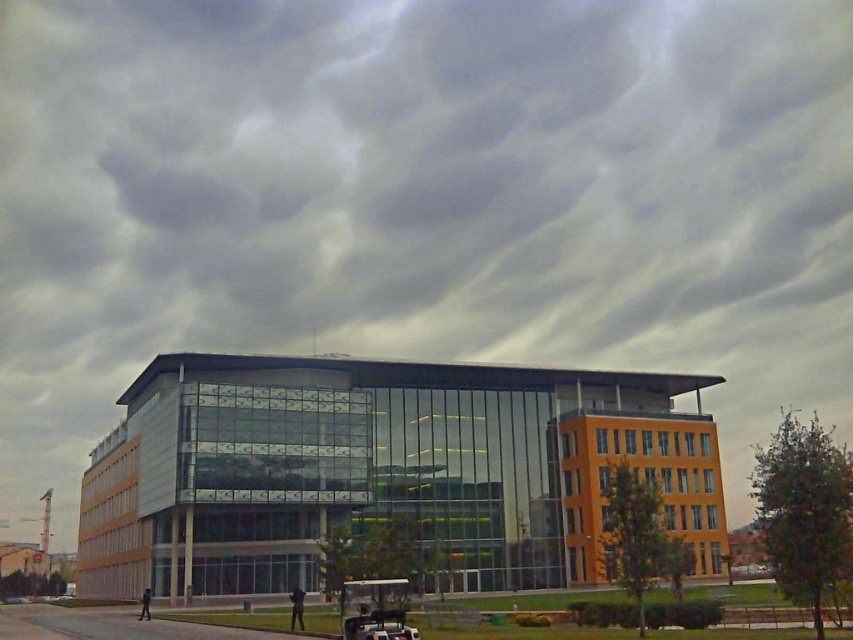
Between glassy modern building at center and white plastic golf cart at lower center, which one is positioned lower?

Positioned lower is glassy modern building at center.

What do you see at coordinates (381, 472) in the screenshot? I see `glassy modern building at center` at bounding box center [381, 472].

You are a GUI agent. You are given a task and a screenshot of the screen. Output one action in this format:
    pyautogui.click(x=<x>, y=<y>)
    Task: Click on the glassy modern building at center
    
    Given the screenshot: What is the action you would take?
    pyautogui.click(x=381, y=472)